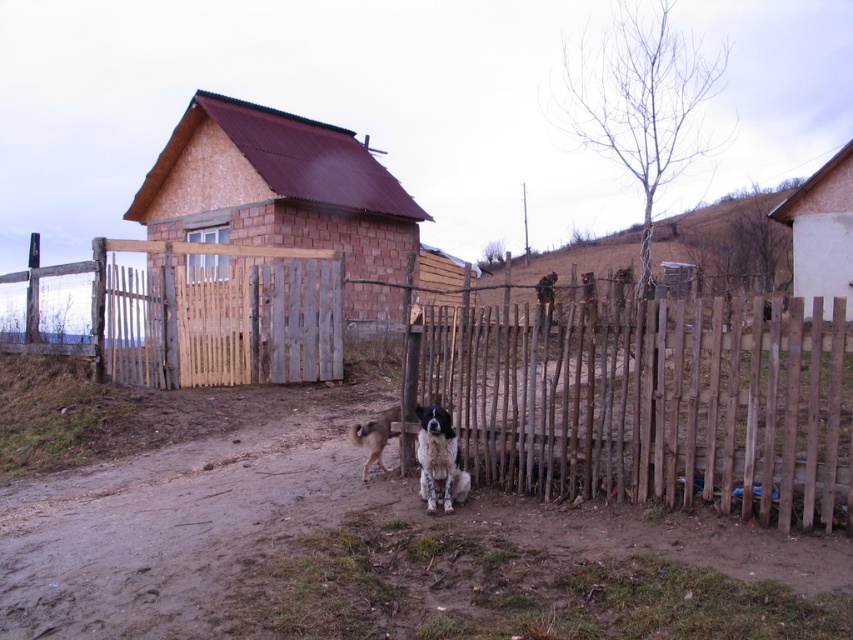
Is point (160, 163) closer to camera compared to point (387, 412)?

No, (160, 163) is behind (387, 412).

The height and width of the screenshot is (640, 853). I want to click on brown brick hut at center, so click(x=277, y=188).

Who is lower down, brown dirt field at upper center or wooden hut at upper right?

wooden hut at upper right is lower down.

Does brown dirt field at upper center have a larger size compared to wooden hut at upper right?

Indeed, brown dirt field at upper center has a larger size compared to wooden hut at upper right.

Between point (755, 220) and point (822, 266), which one is positioned in front?

Point (822, 266) is more forward.

Locate an element on the screen. The height and width of the screenshot is (640, 853). brown dirt field at upper center is located at coordinates (726, 237).

Is brown dirt field at upper center to the right of fluffy white dog at center from the viewer's perspective?

Yes, brown dirt field at upper center is to the right of fluffy white dog at center.

Between brown dirt field at upper center and fluffy white dog at center, which one is positioned lower?

fluffy white dog at center

Describe the element at coordinates (726, 237) in the screenshot. The image size is (853, 640). I see `brown dirt field at upper center` at that location.

Where is `brown dirt field at upper center`? The image size is (853, 640). brown dirt field at upper center is located at coordinates (726, 237).